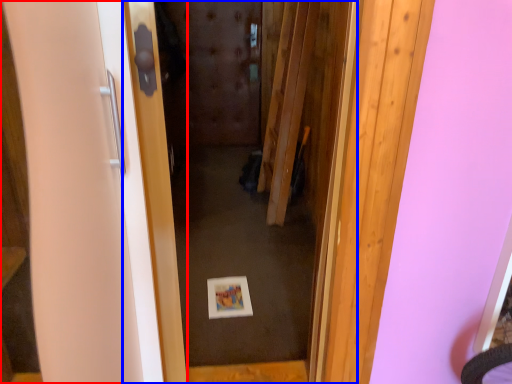
Question: Which of the following is the farthest to the observer, door (highlighted by a red box) or door (highlighted by a blue box)?

Choices:
 (A) door
 (B) door

Answer: (B)